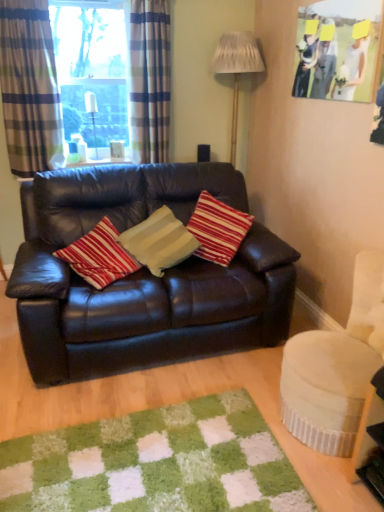
This screenshot has height=512, width=384. What are the coordinates of `vacant space in green shaggy mat at lower center (from a real-world perspective)` in the screenshot? It's located at (147, 461).